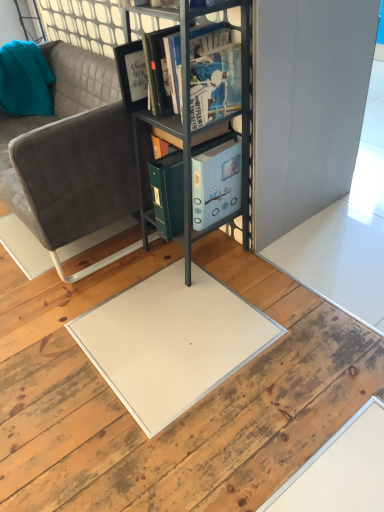
Question: Is the depth of matte black book at center less than that of metallic gray bookshelf at center?

Choices:
 (A) yes
 (B) no

Answer: (B)

Question: From a real-world perspective, is matte black book at center under metallic gray bookshelf at center?

Choices:
 (A) yes
 (B) no

Answer: (B)

Question: From the image's perspective, is matte black book at center above metallic gray bookshelf at center?

Choices:
 (A) yes
 (B) no

Answer: (A)

Question: Is matte black book at center positioned behind metallic gray bookshelf at center?

Choices:
 (A) no
 (B) yes

Answer: (B)

Question: Is matte black book at center in contact with metallic gray bookshelf at center?

Choices:
 (A) yes
 (B) no

Answer: (B)

Question: Based on their positions, is matte black book at center located to the left or right of teal fabric pillow at upper left?

Choices:
 (A) left
 (B) right

Answer: (B)

Question: Is matte black book at center situated inside teal fabric pillow at upper left or outside?

Choices:
 (A) inside
 (B) outside

Answer: (B)

Question: Is matte black book at center bigger or smaller than teal fabric pillow at upper left?

Choices:
 (A) big
 (B) small

Answer: (A)

Question: From the image's perspective, is matte black book at center positioned above or below teal fabric pillow at upper left?

Choices:
 (A) below
 (B) above

Answer: (A)

Question: Considering the positions of metallic gray bookshelf at center and teal fabric pillow at upper left in the image, is metallic gray bookshelf at center bigger or smaller than teal fabric pillow at upper left?

Choices:
 (A) small
 (B) big

Answer: (B)

Question: From a real-world perspective, is metallic gray bookshelf at center physically located above or below teal fabric pillow at upper left?

Choices:
 (A) below
 (B) above

Answer: (A)

Question: Would you say metallic gray bookshelf at center is inside or outside teal fabric pillow at upper left?

Choices:
 (A) inside
 (B) outside

Answer: (B)

Question: In the image, is metallic gray bookshelf at center positioned in front of or behind teal fabric pillow at upper left?

Choices:
 (A) behind
 (B) front

Answer: (B)

Question: From a real-world perspective, is gray fabric couch at center physically located above or below teal fabric pillow at upper left?

Choices:
 (A) below
 (B) above

Answer: (A)

Question: Is point (69, 120) positioned closer to the camera than point (6, 80)?

Choices:
 (A) closer
 (B) farther

Answer: (A)